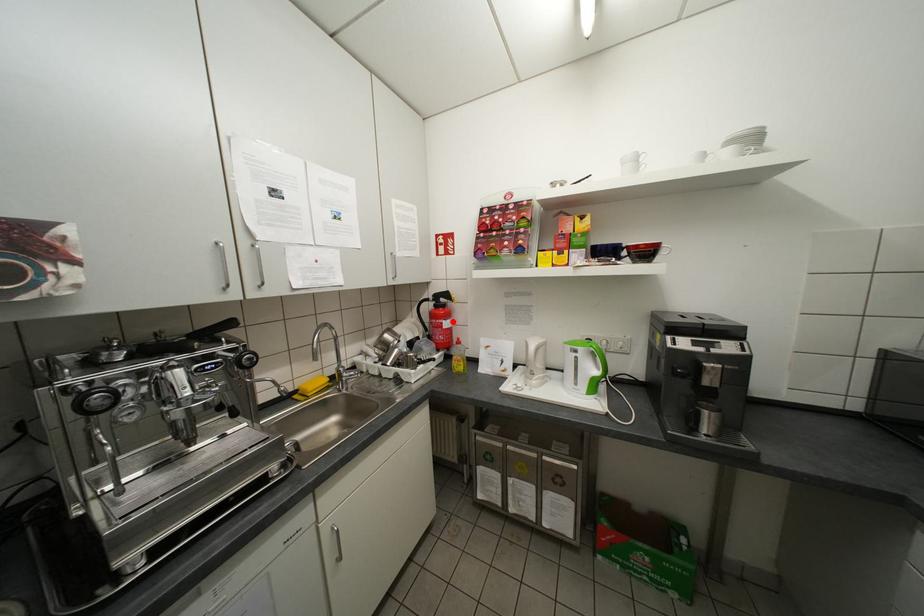
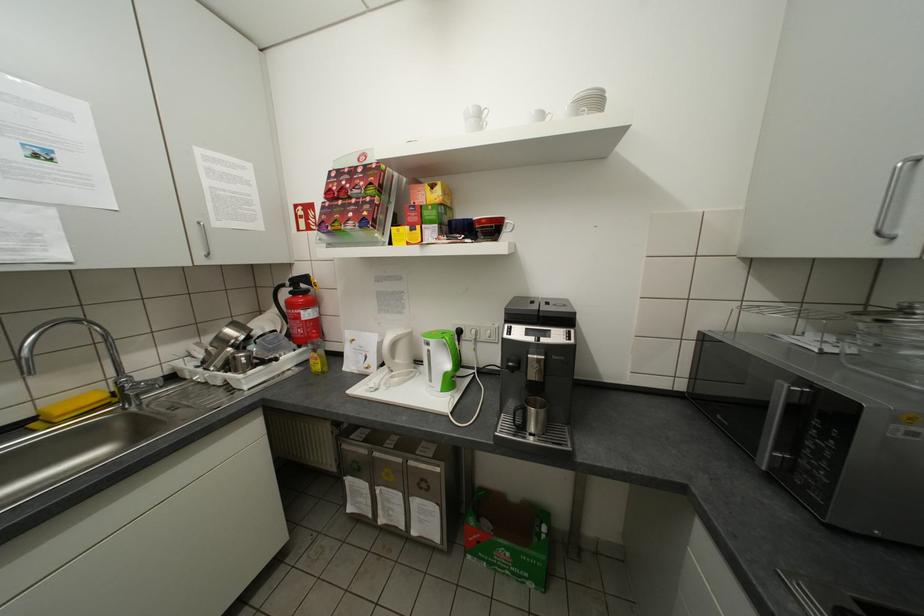
Question: I am providing you with two images of the same scene from different viewpoints. A red point is marked on the first image. At the location where the point appears in image 1, is it still visible in image 2?

Choices:
 (A) Yes
 (B) No

Answer: (A)